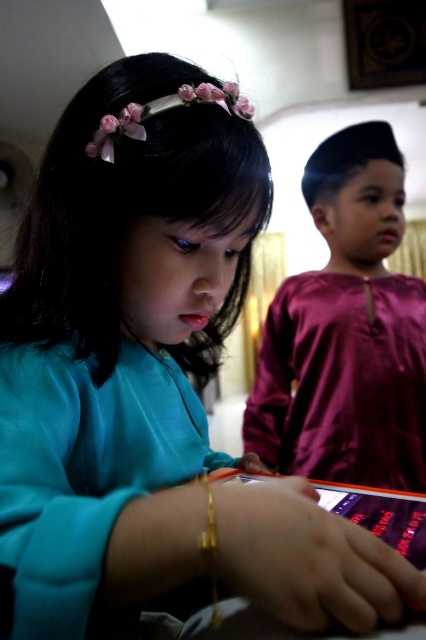
You are a photographer trying to capture a clear shot of both the teal satin robe at lower left and the gold metallic bracelet at lower center. Since you can only focus on one object at a time, which one should you choose to ensure the other remains somewhat in focus?

The teal satin robe at lower left is in front of the gold metallic bracelet at lower center. To ensure the bracelet stays somewhat in focus while focusing on the robe, you should focus on the teal satin robe at lower left. This way, the gold metallic bracelet at lower center will be slightly out of focus but still visible.

You are a photographer trying to capture a clear shot of the shiny maroon shirt at center and the purple glossy book at lower center. Which object should you focus on to ensure it appears sharp in the photo?

The shiny maroon shirt at center is located above the purple glossy book at lower center, so focusing on the shiny maroon shirt at center would ensure it appears sharp since it is closer to the camera.